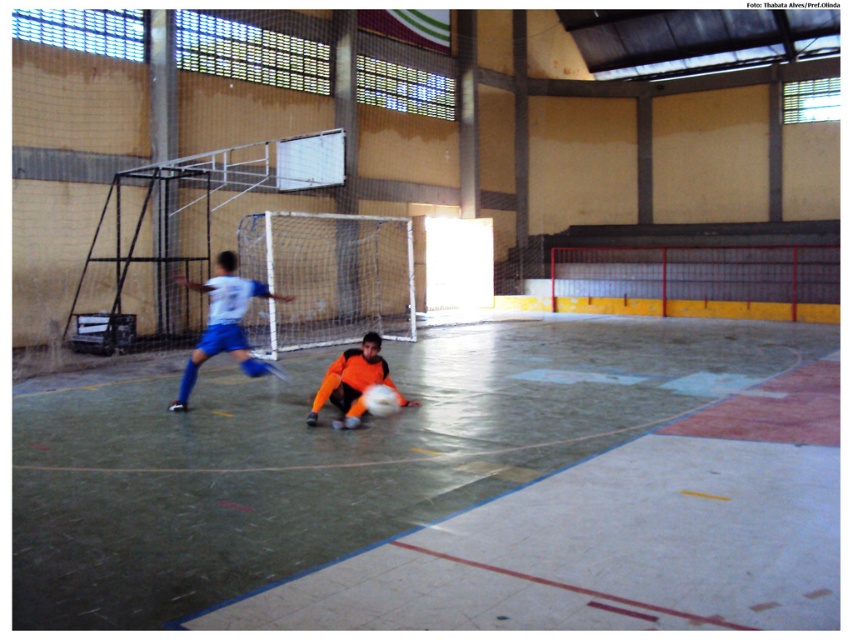
Does white mesh net at center have a greater width compared to orange jersey at center?

Correct, the width of white mesh net at center exceeds that of orange jersey at center.

This screenshot has width=853, height=640. Describe the element at coordinates (328, 278) in the screenshot. I see `white mesh net at center` at that location.

Does point (361, 323) lie behind point (331, 385)?

That is True.

This screenshot has height=640, width=853. What are the coordinates of `white mesh net at center` in the screenshot? It's located at pos(328,278).

Who is positioned more to the left, white matte jersey at center or orange jersey at center?

white matte jersey at center is more to the left.

Is white matte jersey at center to the right of orange jersey at center from the viewer's perspective?

Incorrect, white matte jersey at center is not on the right side of orange jersey at center.

Does point (207, 346) lie behind point (332, 396)?

Yes, it is.

Where is `white matte jersey at center`? Image resolution: width=853 pixels, height=640 pixels. white matte jersey at center is located at coordinates (224, 323).

Which is below, white mesh net at center or white matte jersey at center?

white matte jersey at center is lower down.

Is white mesh net at center below white matte jersey at center?

Actually, white mesh net at center is above white matte jersey at center.

This screenshot has height=640, width=853. Describe the element at coordinates (328, 278) in the screenshot. I see `white mesh net at center` at that location.

You are a GUI agent. You are given a task and a screenshot of the screen. Output one action in this format:
    pyautogui.click(x=<x>, y=<y>)
    Task: Click on the white mesh net at center
    
    Given the screenshot: What is the action you would take?
    pyautogui.click(x=328, y=278)